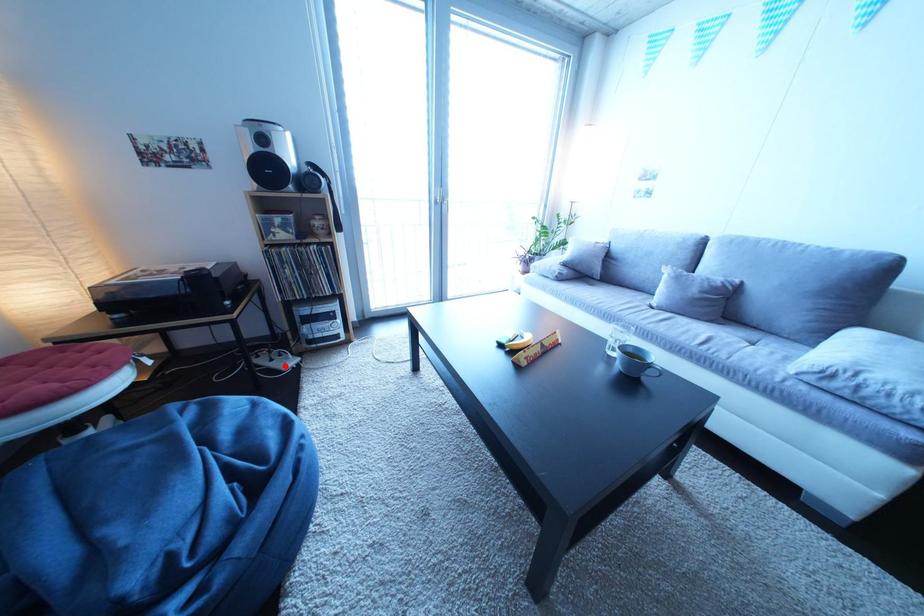
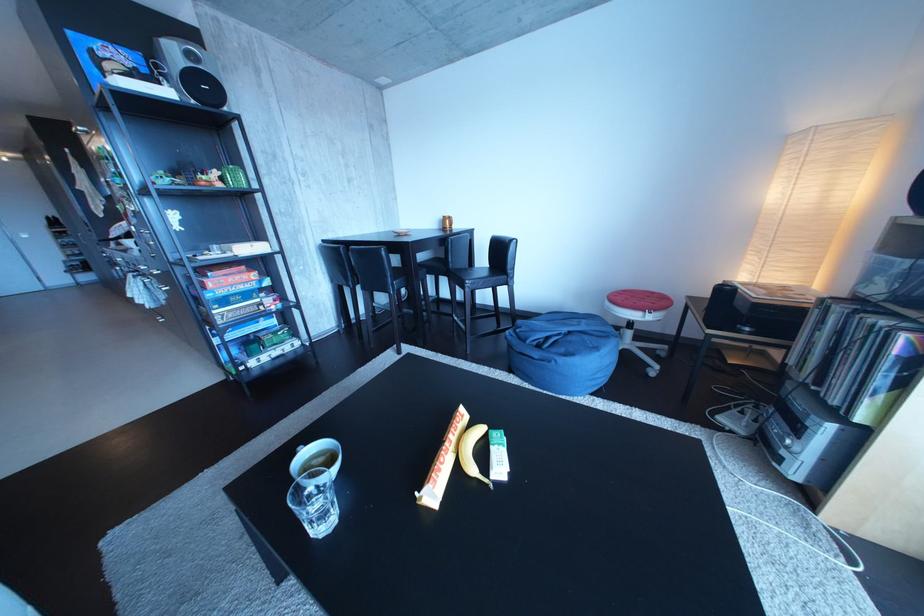
Locate, in the second image, the point that corresponds to the highlighted location in the first image.

(755, 419)